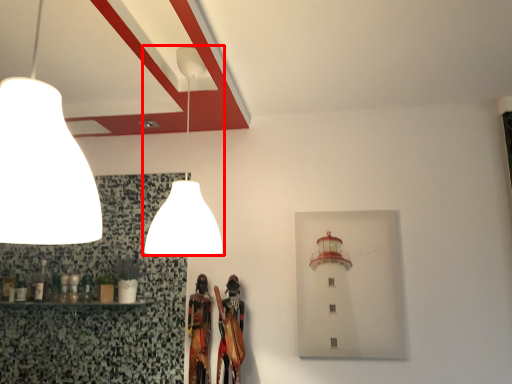
Question: From the image's perspective, considering the relative positions of lamp (annotated by the red box) and lamp in the image provided, where is lamp (annotated by the red box) located with respect to the staircase?

Choices:
 (A) below
 (B) above

Answer: (A)